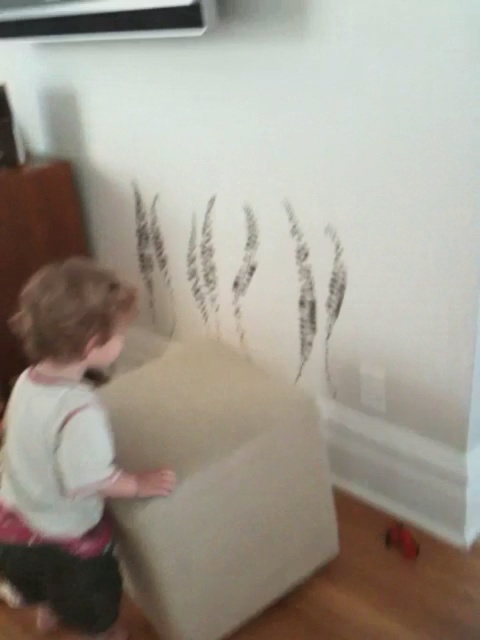
Is point (115, 323) closer to viewer compared to point (405, 531)?

Yes.

Between point (31, 429) and point (405, 531), which one is positioned in front?

Positioned in front is point (31, 429).

Locate an element on the screen. This screenshot has width=480, height=640. white cotton toddler at center is located at coordinates (67, 449).

Find the location of `white cotton toddler at center`. white cotton toddler at center is located at coordinates (67, 449).

Does white cotton toddler at center appear on the right side of black paper at center?

In fact, white cotton toddler at center is to the left of black paper at center.

Describe the element at coordinates (67, 449) in the screenshot. I see `white cotton toddler at center` at that location.

Which is in front, point (28, 502) or point (337, 237)?

Point (28, 502) is more forward.

Where is `white cotton toddler at center`? white cotton toddler at center is located at coordinates (67, 449).

Does black paper at center appear on the left side of rubberized red toy at lower right?

A: Yes, black paper at center is to the left of rubberized red toy at lower right.

Which is behind, point (170, 321) or point (407, 529)?

The point (170, 321) is more distant.

Between point (305, 348) and point (408, 548), which one is positioned in front?

Positioned in front is point (408, 548).

Image resolution: width=480 pixels, height=640 pixels. I want to click on black paper at center, so pos(154,262).